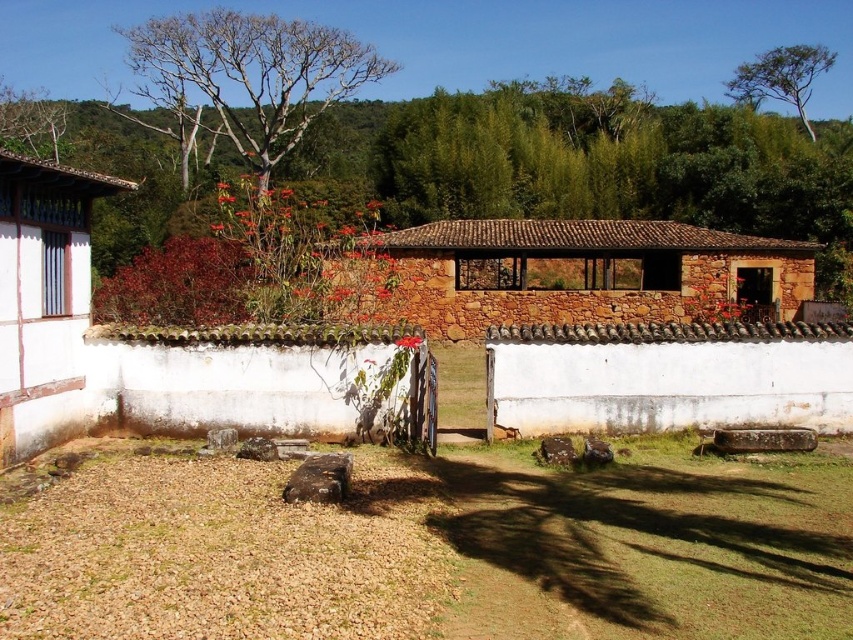
Between point (4, 637) and point (804, 92), which one is positioned in front?

Point (4, 637) is in front.

Which is above, brown grass at lower center or green leafy tree at upper right?

green leafy tree at upper right

You are a GUI agent. You are given a task and a screenshot of the screen. Output one action in this format:
    pyautogui.click(x=<x>, y=<y>)
    Task: Click on the brown grass at lower center
    The width and height of the screenshot is (853, 640).
    Given the screenshot: What is the action you would take?
    pyautogui.click(x=432, y=547)

Locate an element on the screen. Image resolution: width=853 pixels, height=640 pixels. brown grass at lower center is located at coordinates (432, 547).

Between bare wood tree at upper left and green leafy tree at upper right, which one is positioned higher?

green leafy tree at upper right is above.

Is bare wood tree at upper left above green leafy tree at upper right?

No, bare wood tree at upper left is not above green leafy tree at upper right.

Is point (231, 124) more distant than point (780, 45)?

No, it is in front of (780, 45).

Identify the location of bare wood tree at upper left. (252, 74).

Between brown grass at lower center and bare wood tree at upper left, which one has less height?

brown grass at lower center

Who is more distant from viewer, (299,545) or (183,92)?

The point (183,92) is more distant.

Identify the location of brown grass at lower center. (432, 547).